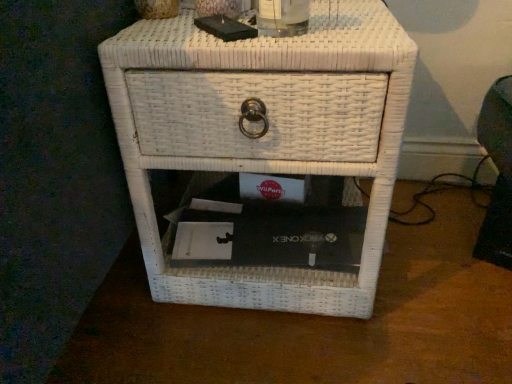
Question: Is white wicker nightstand at center wider or thinner than clear glass bottle at upper center?

Choices:
 (A) wide
 (B) thin

Answer: (A)

Question: From a real-world perspective, is white wicker nightstand at center physically located above or below clear glass bottle at upper center?

Choices:
 (A) above
 (B) below

Answer: (B)

Question: Is point (192, 135) closer or farther from the camera than point (297, 0)?

Choices:
 (A) closer
 (B) farther

Answer: (B)

Question: Is clear glass bottle at upper center bigger or smaller than white wicker nightstand at center?

Choices:
 (A) small
 (B) big

Answer: (A)

Question: From a real-world perspective, is clear glass bottle at upper center positioned above or below white wicker nightstand at center?

Choices:
 (A) below
 (B) above

Answer: (B)

Question: In terms of height, does clear glass bottle at upper center look taller or shorter compared to white wicker nightstand at center?

Choices:
 (A) short
 (B) tall

Answer: (A)

Question: From the image's perspective, is clear glass bottle at upper center located above or below white wicker nightstand at center?

Choices:
 (A) below
 (B) above

Answer: (B)